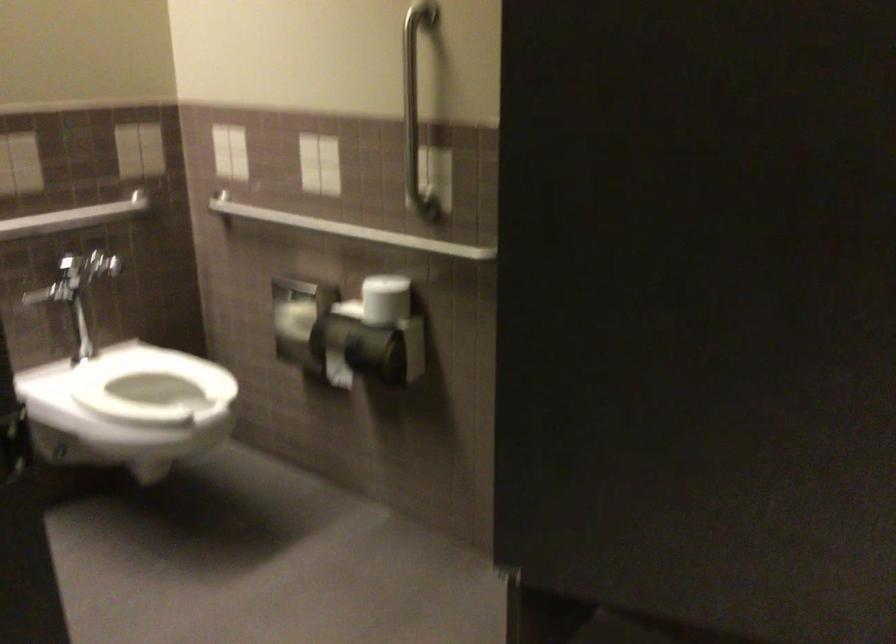
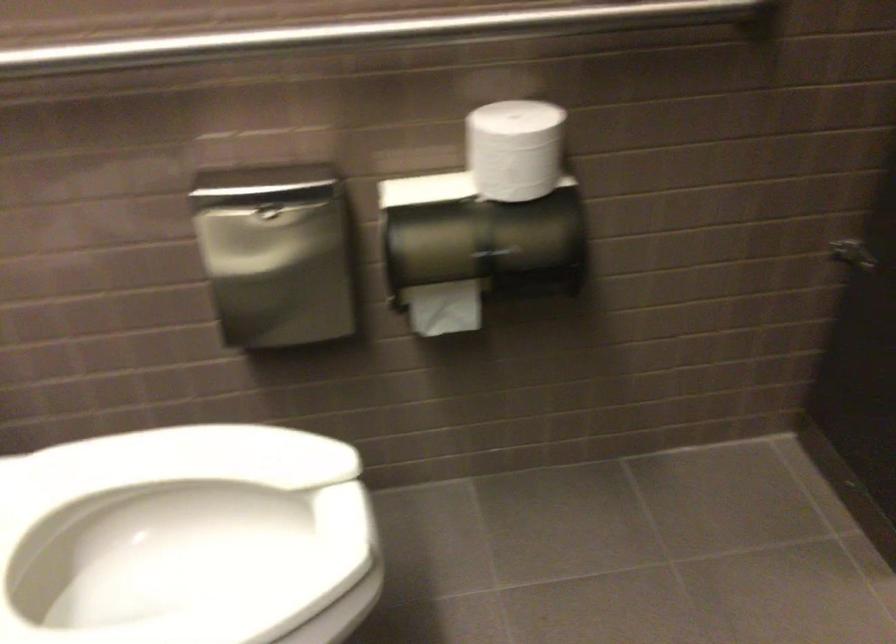
In the second image, find the point that corresponds to (x=371, y=290) in the first image.

(514, 149)